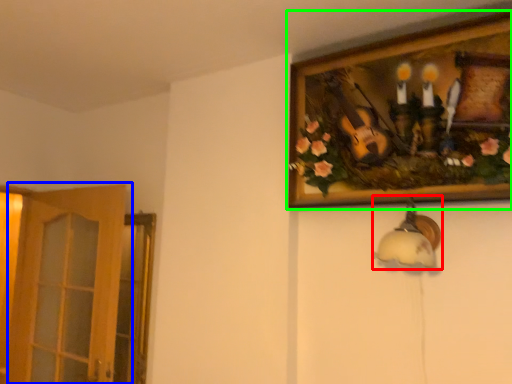
Question: Based on their relative distances, which object is farther from lamp (highlighted by a red box)? Choose from door (highlighted by a blue box) and picture frame (highlighted by a green box).

Choices:
 (A) door
 (B) picture frame

Answer: (A)